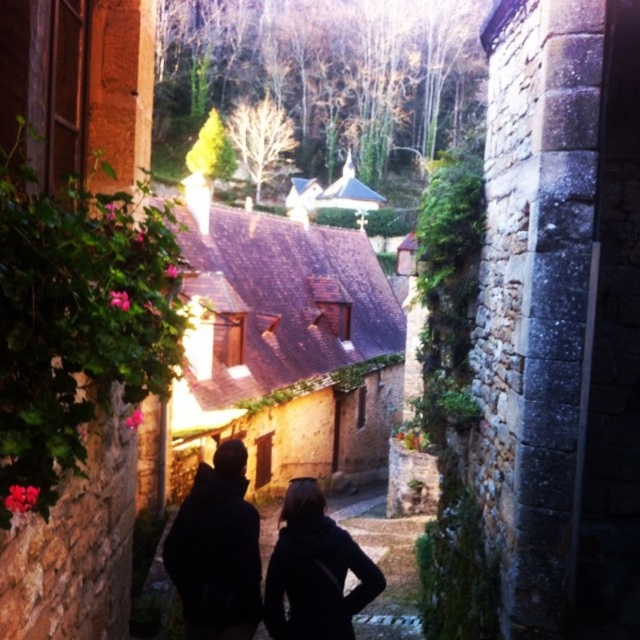
Question: Is black matte clothing at center positioned in front of black matte jacket at center?

Choices:
 (A) yes
 (B) no

Answer: (A)

Question: Is black matte clothing at center thinner than black matte jacket at center?

Choices:
 (A) yes
 (B) no

Answer: (B)

Question: Among these points, which one is farthest from the camera?

Choices:
 (A) (348, 636)
 (B) (192, 604)

Answer: (B)

Question: Which point appears farthest from the camera in this image?

Choices:
 (A) (184, 531)
 (B) (284, 628)

Answer: (A)

Question: Which object is closer to the camera taking this photo?

Choices:
 (A) black matte jacket at center
 (B) black matte clothing at center

Answer: (B)

Question: Where is black matte clothing at center located in relation to black matte jacket at center in the image?

Choices:
 (A) right
 (B) left

Answer: (B)